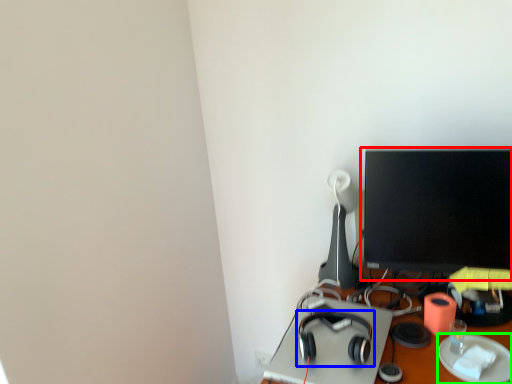
Question: Which object is the farthest from computer monitor (highlighted by a red box)? Choose among these: headphones (highlighted by a blue box) or paper plate (highlighted by a green box).

Choices:
 (A) headphones
 (B) paper plate

Answer: (A)